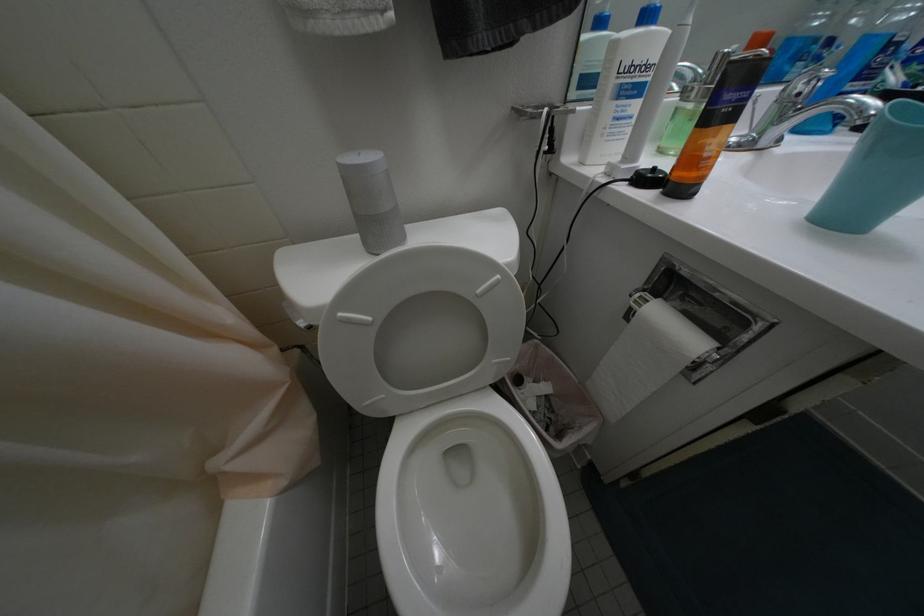
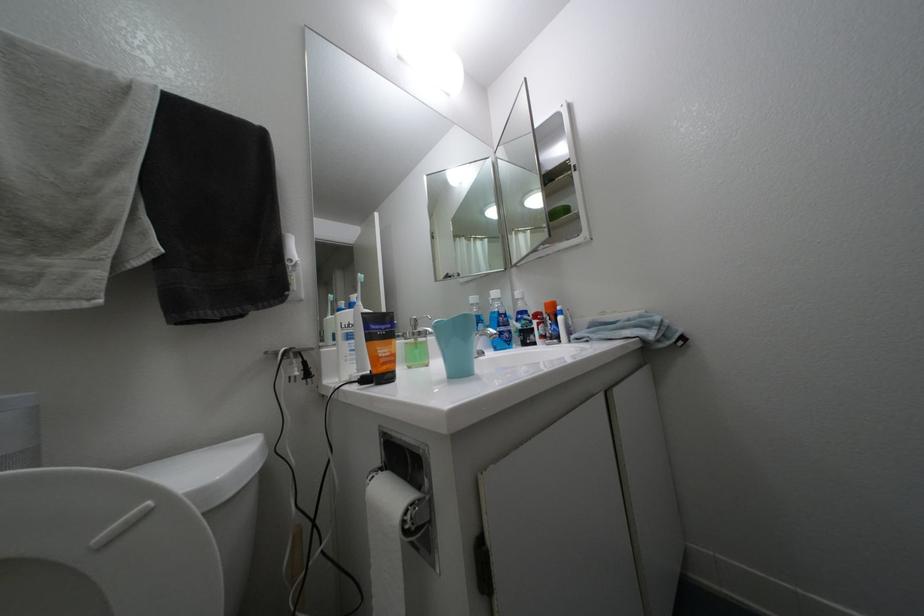
The images are taken continuously from a first-person perspective. In which direction is your viewpoint rotating?

The camera rotated toward right-up.